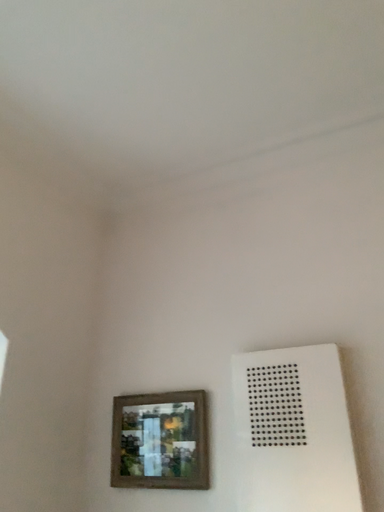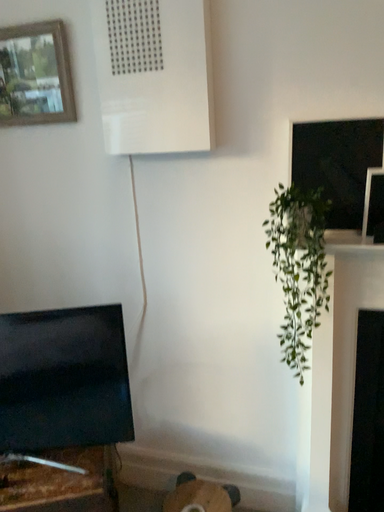
Question: How did the camera likely rotate when shooting the video?

Choices:
 (A) rotated right
 (B) rotated left

Answer: (A)